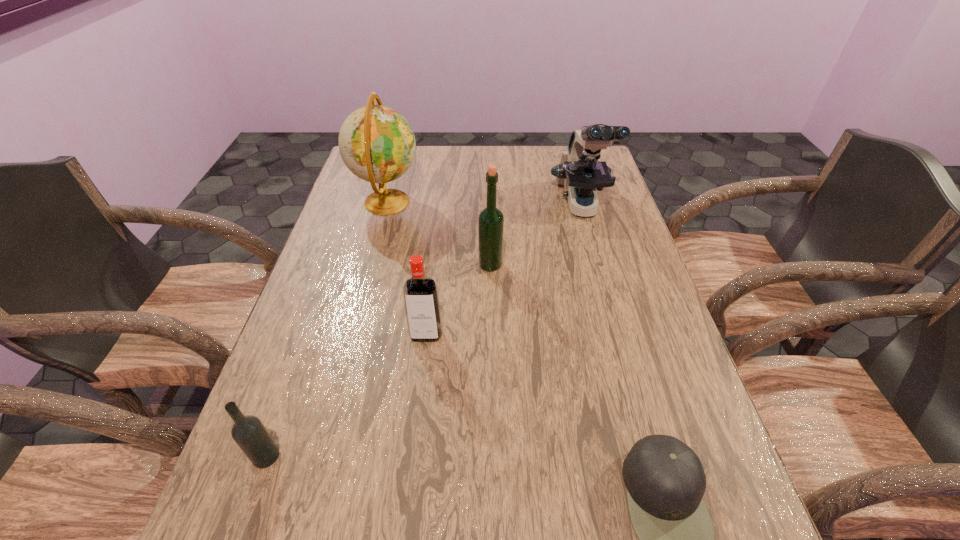
Where is `vacant space at the far edge`? The height and width of the screenshot is (540, 960). vacant space at the far edge is located at coordinates (533, 176).

In the image, there is a desktop. At what (x,y) coordinates should I click in order to perform the action: click on vacant region at the left edge. Please return your answer as a coordinate pair (x, y). Looking at the image, I should click on coord(311,280).

In the image, there is a desktop. Identify the location of vacant space at the right edge. (624, 285).

Locate an element on the screen. vacant space that is in between the globe and the fifth tallest object is located at coordinates (326, 329).

This screenshot has height=540, width=960. I want to click on vacant space that's between the nearer vodka and the right vodka, so pos(346,395).

Locate an element on the screen. vacant point located between the right vodka and the microscope is located at coordinates (504, 271).

Locate an element on the screen. free space that is in between the left vodka and the globe is located at coordinates (326, 329).

Where is `free space between the fifth tallest object and the globe`? free space between the fifth tallest object and the globe is located at coordinates (326, 329).

At what (x,y) coordinates should I click in order to perform the action: click on object that ranks as the fourth closest to the shortest object. Please return your answer as a coordinate pair (x, y). This screenshot has width=960, height=540. Looking at the image, I should click on (580, 172).

Find the location of a particular element. The width and height of the screenshot is (960, 540). object that is the third closest one to the globe is located at coordinates 580,172.